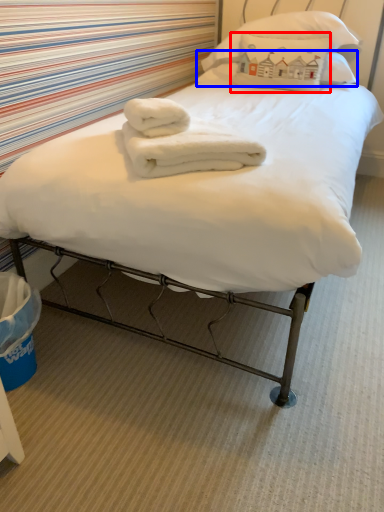
Question: Among these objects, which one is farthest to the camera, pillow (highlighted by a red box) or pillow (highlighted by a blue box)?

Choices:
 (A) pillow
 (B) pillow

Answer: (B)